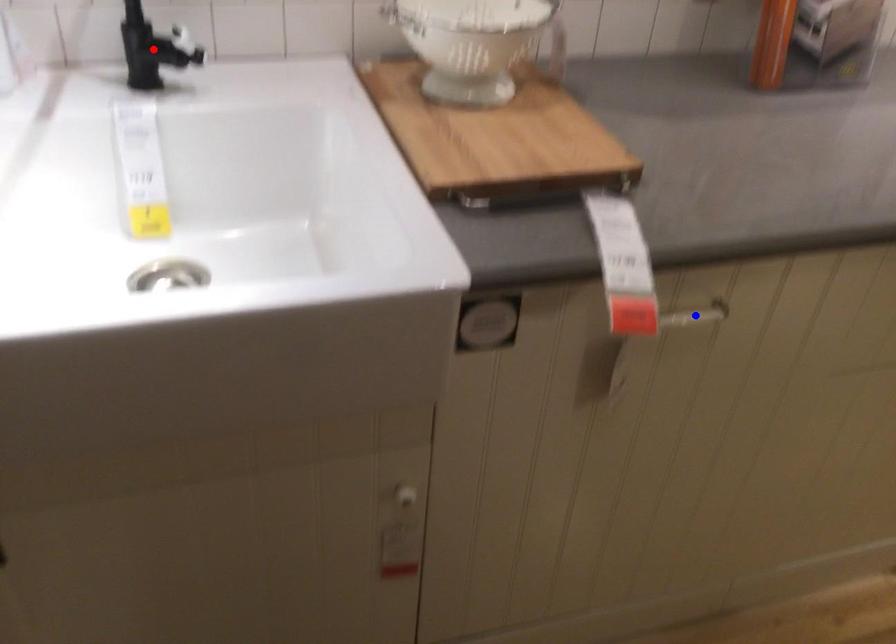
Question: Which of the two points in the image is closer to the camera?

Choices:
 (A) Blue point is closer.
 (B) Red point is closer.

Answer: (A)